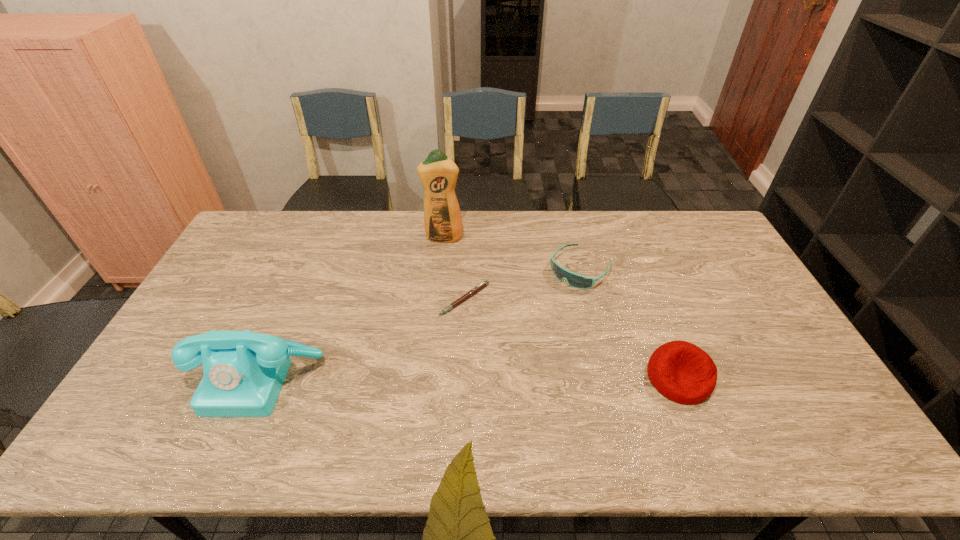
What are the coordinates of `telephone positioned at the near edge` in the screenshot? It's located at (243, 372).

Find the location of a particular element. beanbag at the near edge is located at coordinates (682, 372).

The image size is (960, 540). Find the location of `object located in the left edge section of the desktop`. object located in the left edge section of the desktop is located at coordinates (243, 372).

Identify the location of object at the near left corner. This screenshot has height=540, width=960. (243, 372).

At what (x,y) coordinates should I click in order to perform the action: click on vacant space at the far edge. Please return your answer as a coordinate pair (x, y). Looking at the image, I should click on (607, 249).

Where is `blank area at the near edge`? The image size is (960, 540). blank area at the near edge is located at coordinates (554, 411).

In the image, there is a desktop. In order to click on vacant space at the left edge in this screenshot , I will do `click(250, 266)`.

Image resolution: width=960 pixels, height=540 pixels. What are the coordinates of `blank space at the right edge of the desktop` in the screenshot? It's located at (773, 328).

At what (x,y) coordinates should I click in order to perform the action: click on vacant area that lies between the pen and the leftmost object. Please return your answer as a coordinate pair (x, y). Looking at the image, I should click on [x=362, y=339].

At what (x,y) coordinates should I click in order to perform the action: click on vacant point located between the sunglasses and the detergent. Please return your answer as a coordinate pair (x, y). The width and height of the screenshot is (960, 540). Looking at the image, I should click on (512, 253).